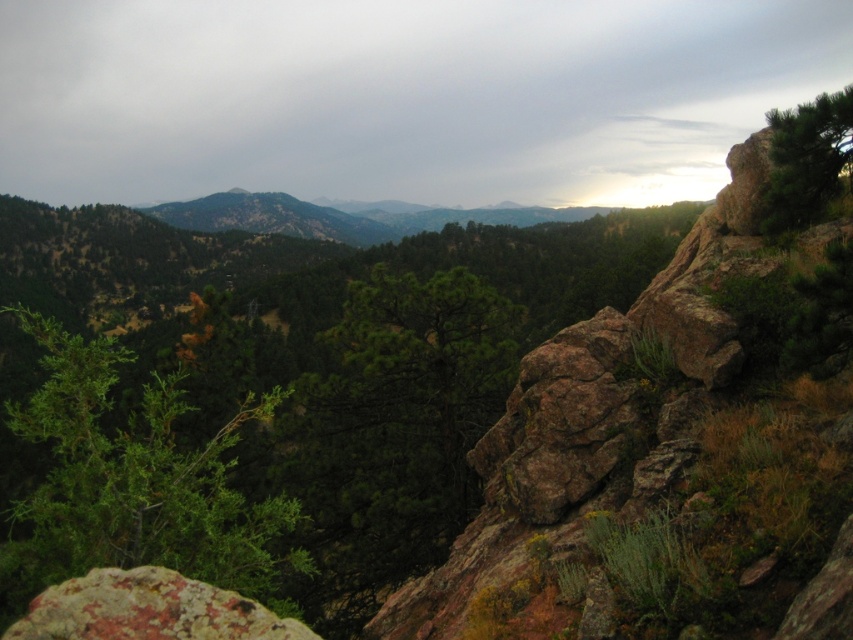
Does green leafy tree at center lie behind green textured pine tree at upper right?

No, it is not.

Looking at this image, is green leafy tree at center below green textured pine tree at upper right?

Indeed, green leafy tree at center is positioned under green textured pine tree at upper right.

You are a GUI agent. You are given a task and a screenshot of the screen. Output one action in this format:
    pyautogui.click(x=<x>, y=<y>)
    Task: Click on the green leafy tree at center
    This screenshot has width=853, height=640.
    Given the screenshot: What is the action you would take?
    pyautogui.click(x=135, y=484)

Where is `green leafy tree at center`? Image resolution: width=853 pixels, height=640 pixels. green leafy tree at center is located at coordinates (135, 484).

Based on the photo, measure the distance from lichen-covered rock at lower left to green textured pine tree at upper right.

lichen-covered rock at lower left is 7.61 meters away from green textured pine tree at upper right.

Does lichen-covered rock at lower left come behind green textured pine tree at upper right?

No.

Who is more forward, (167, 602) or (787, 164)?

Point (167, 602) is more forward.

Where is `lichen-covered rock at lower left`? The width and height of the screenshot is (853, 640). lichen-covered rock at lower left is located at coordinates (148, 609).

Between green leafy tree at center and lichen-covered rock at lower left, which one is positioned higher?

Positioned higher is lichen-covered rock at lower left.

Can you confirm if green leafy tree at center is positioned above lichen-covered rock at lower left?

No, green leafy tree at center is not above lichen-covered rock at lower left.

The height and width of the screenshot is (640, 853). Find the location of `green leafy tree at center`. green leafy tree at center is located at coordinates (135, 484).